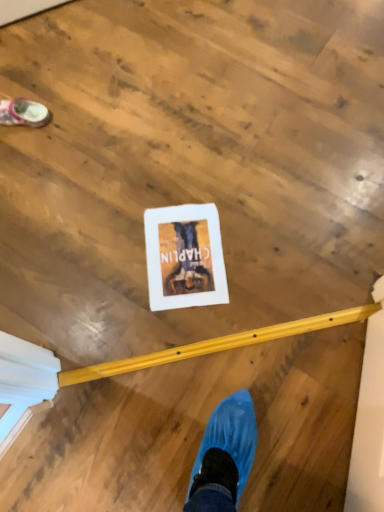
The width and height of the screenshot is (384, 512). Identify the location of free space to the back side of white fabric shoe at upper left. (34, 75).